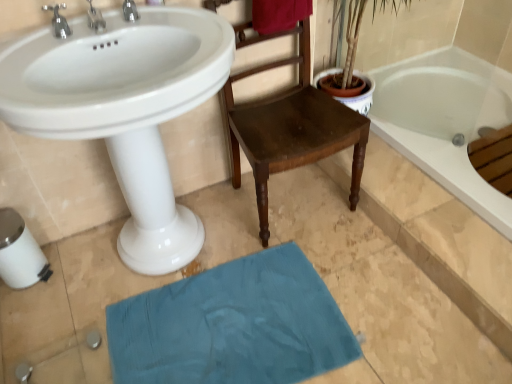
The height and width of the screenshot is (384, 512). I want to click on empty space that is in between silver metallic faucet at upper left, positioned as the 3th tap in right-to-left order, and silver metallic tap at upper left, which ranks as the first tap in right-to-left order, so click(x=101, y=29).